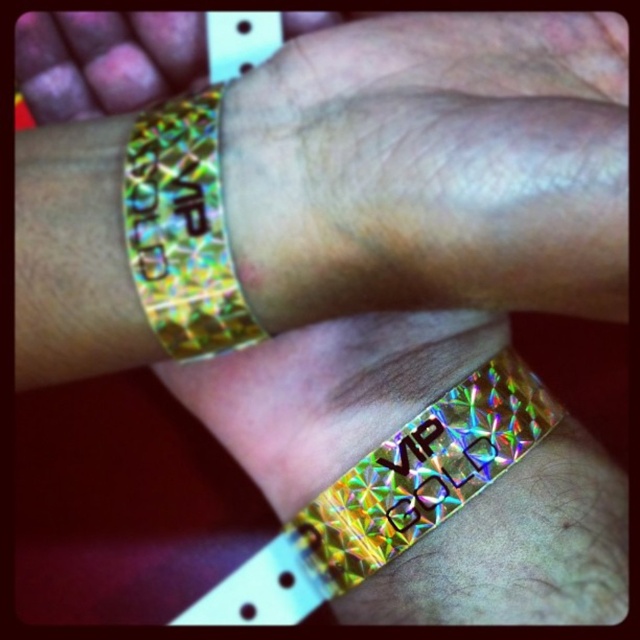
Question: Does holographic vip wristband at center have a lesser width compared to holographic gold wristband at upper center?

Choices:
 (A) yes
 (B) no

Answer: (B)

Question: In this image, where is holographic vip wristband at center located relative to holographic gold wristband at upper center?

Choices:
 (A) below
 (B) above

Answer: (A)

Question: Among these points, which one is nearest to the camera?

Choices:
 (A) (156, 234)
 (B) (310, 548)

Answer: (A)

Question: Which point is closer to the camera taking this photo?

Choices:
 (A) (182, 316)
 (B) (225, 589)

Answer: (A)

Question: Is holographic vip wristband at center to the right of holographic gold wristband at upper center from the viewer's perspective?

Choices:
 (A) no
 (B) yes

Answer: (B)